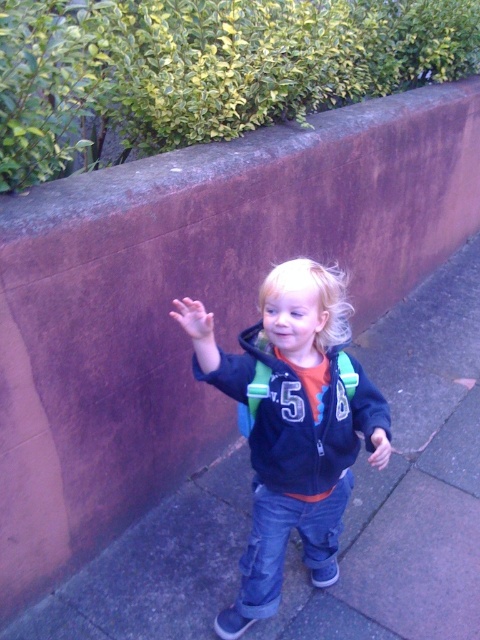
Is matte blue hoodie at center behind matte black jacket at center?

No, matte blue hoodie at center is in front of matte black jacket at center.

Which is behind, point (247, 355) or point (313, 493)?

Positioned behind is point (313, 493).

Which is in front, point (189, 312) or point (305, 436)?

Point (189, 312) is in front.

The image size is (480, 640). I want to click on matte blue hoodie at center, so click(x=292, y=424).

What do you see at coordinates (408, 481) in the screenshot? Image resolution: width=480 pixels, height=640 pixels. I see `gray concrete pavement at center` at bounding box center [408, 481].

Does point (359, 492) come farther from viewer compared to point (253, 348)?

Yes.

In order to click on gray concrete pavement at center in this screenshot , I will do `click(408, 481)`.

Between point (56, 86) and point (276, 461), which one is positioned in front?

Point (56, 86) is more forward.

Locate an element on the screen. The width and height of the screenshot is (480, 640). green leafy hedge at upper left is located at coordinates (203, 70).

Where is `green leafy hedge at upper left`? green leafy hedge at upper left is located at coordinates (203, 70).